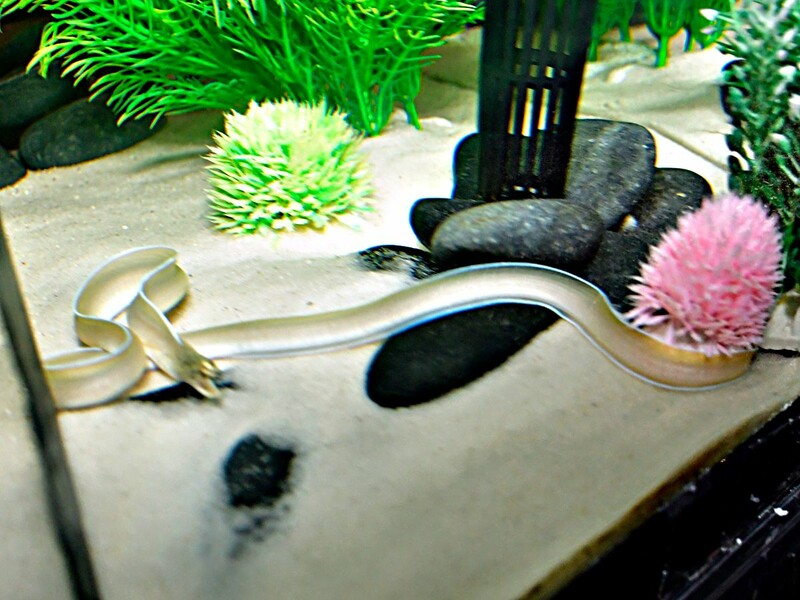
You are a GUI agent. You are given a task and a screenshot of the screen. Output one action in this format:
    pyautogui.click(x=<x>, y=<y>)
    Task: Click on the short stubby green fake aquarium plant
    
    Given the screenshot: What is the action you would take?
    pyautogui.click(x=280, y=168)